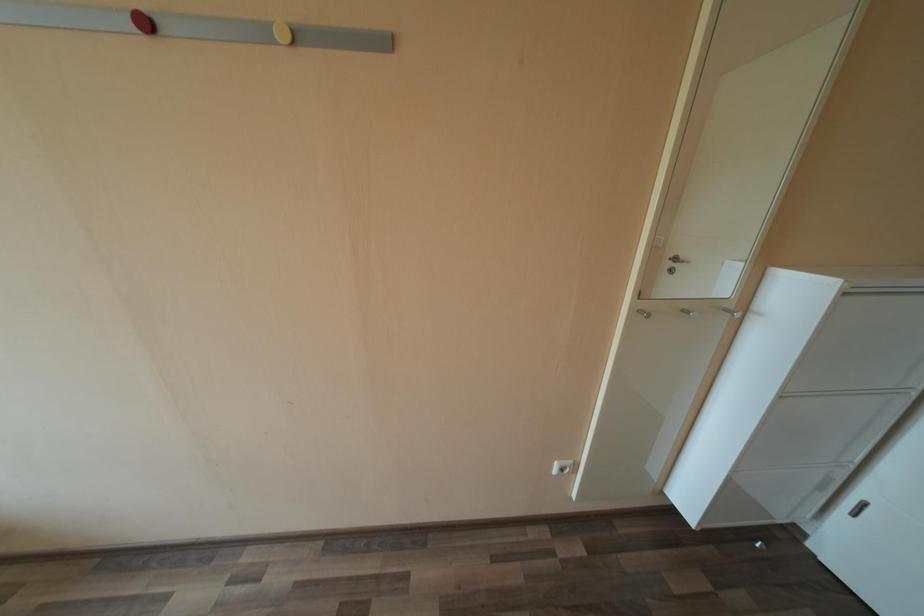
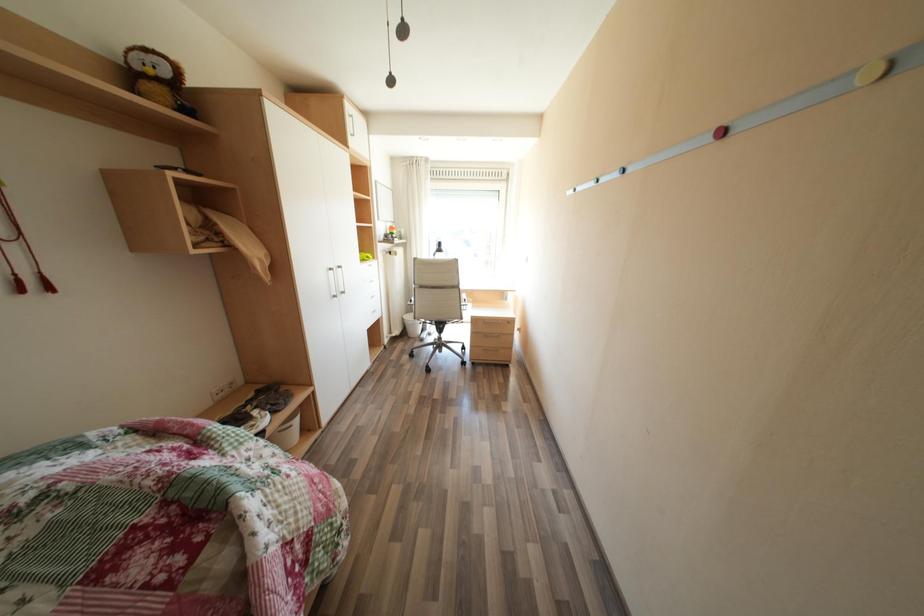
Consider the image. The first image is from the beginning of the video and the second image is from the end. How did the camera likely rotate when shooting the video?

The rotation direction of the camera is left-down.